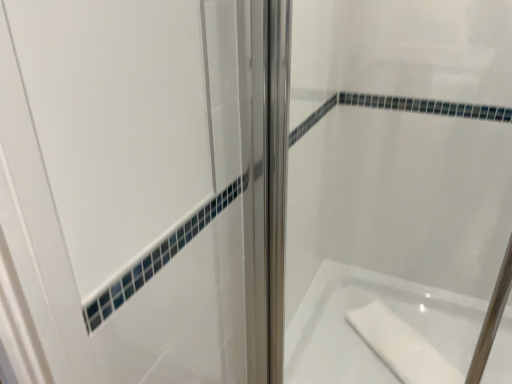
Question: Does white glossy bathtub at lower right have a lesser width compared to clear glass shower door at center?

Choices:
 (A) no
 (B) yes

Answer: (A)

Question: Is white glossy bathtub at lower right positioned with its back to clear glass shower door at center?

Choices:
 (A) no
 (B) yes

Answer: (A)

Question: Is white glossy bathtub at lower right surrounding clear glass shower door at center?

Choices:
 (A) no
 (B) yes

Answer: (A)

Question: Is white glossy bathtub at lower right to the left of clear glass shower door at center from the viewer's perspective?

Choices:
 (A) yes
 (B) no

Answer: (B)

Question: Considering the relative positions of white glossy bathtub at lower right and clear glass shower door at center in the image provided, is white glossy bathtub at lower right to the right of clear glass shower door at center from the viewer's perspective?

Choices:
 (A) yes
 (B) no

Answer: (A)

Question: Based on their sizes in the image, would you say white matte soap at lower right is bigger or smaller than clear glass shower door at center?

Choices:
 (A) big
 (B) small

Answer: (B)

Question: Based on their positions, is white matte soap at lower right located to the left or right of clear glass shower door at center?

Choices:
 (A) left
 (B) right

Answer: (B)

Question: Considering the positions of white matte soap at lower right and clear glass shower door at center in the image, is white matte soap at lower right wider or thinner than clear glass shower door at center?

Choices:
 (A) wide
 (B) thin

Answer: (A)

Question: Is white matte soap at lower right spatially inside clear glass shower door at center, or outside of it?

Choices:
 (A) outside
 (B) inside

Answer: (A)

Question: From the image's perspective, is clear glass shower door at center above or below white matte soap at lower right?

Choices:
 (A) above
 (B) below

Answer: (A)

Question: Considering the positions of clear glass shower door at center and white matte soap at lower right in the image, is clear glass shower door at center wider or thinner than white matte soap at lower right?

Choices:
 (A) thin
 (B) wide

Answer: (A)

Question: In the image, is clear glass shower door at center positioned in front of or behind white matte soap at lower right?

Choices:
 (A) behind
 (B) front

Answer: (B)

Question: Is clear glass shower door at center to the left or to the right of white matte soap at lower right in the image?

Choices:
 (A) left
 (B) right

Answer: (A)

Question: Is white glossy bathtub at lower right situated inside clear glass shower door at center or outside?

Choices:
 (A) outside
 (B) inside

Answer: (A)

Question: Based on their sizes in the image, would you say white glossy bathtub at lower right is bigger or smaller than clear glass shower door at center?

Choices:
 (A) big
 (B) small

Answer: (A)